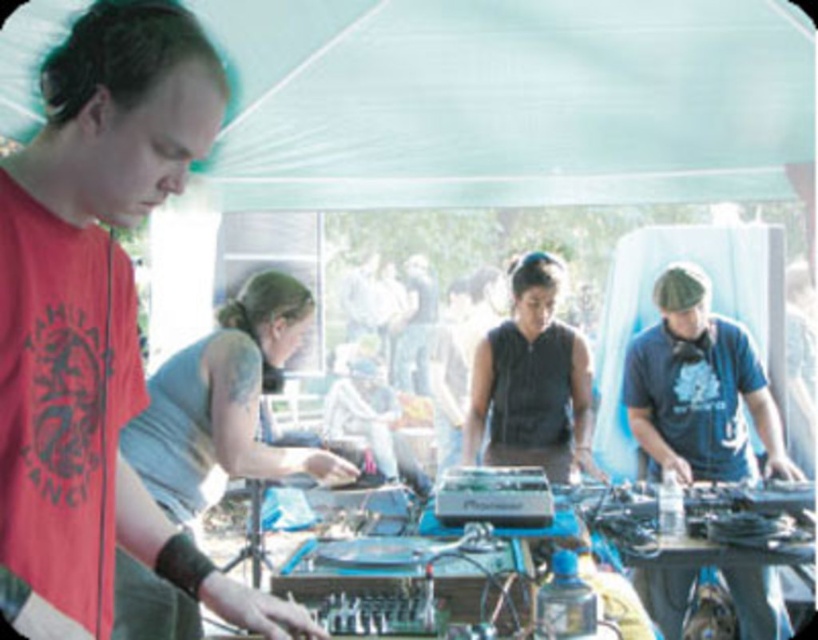
Question: Which object appears farthest from the camera in this image?

Choices:
 (A) gray matte shirt at center
 (B) blue fabric hat at right
 (C) transparent nylon canopy at upper center
 (D) black matte vest at center

Answer: (D)

Question: Does transparent nylon canopy at upper center appear over blue fabric hat at right?

Choices:
 (A) no
 (B) yes

Answer: (B)

Question: Which point appears farthest from the camera in this image?

Choices:
 (A) (781, 438)
 (B) (291, 310)
 (C) (661, 163)
 (D) (533, 321)

Answer: (A)

Question: Among these objects, which one is farthest from the camera?

Choices:
 (A) blue fabric hat at right
 (B) black matte vest at center
 (C) transparent nylon canopy at upper center
 (D) gray matte shirt at center

Answer: (B)

Question: Can you confirm if transparent nylon canopy at upper center is positioned to the left of blue fabric hat at right?

Choices:
 (A) no
 (B) yes

Answer: (B)

Question: Does transparent nylon canopy at upper center have a greater width compared to blue fabric hat at right?

Choices:
 (A) no
 (B) yes

Answer: (B)